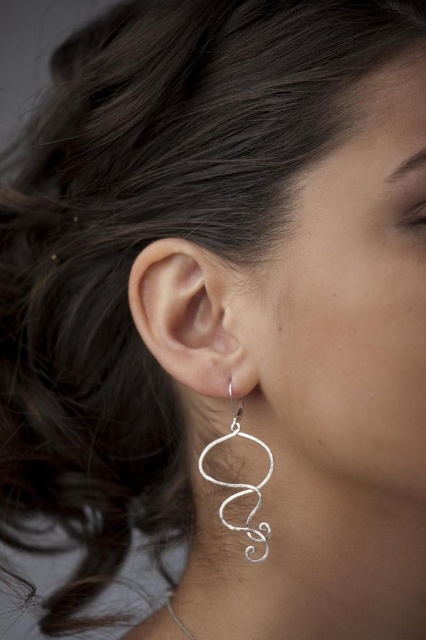
Question: Which of the following is the closest to the observer?

Choices:
 (A) silver wire earring at lower left
 (B) silver wire necklace at lower center
 (C) silver wire earring at center

Answer: (C)

Question: Does silver wire earring at center appear over silver wire earring at lower left?

Choices:
 (A) no
 (B) yes

Answer: (B)

Question: Among these points, which one is nearest to the camera?

Choices:
 (A) (229, 502)
 (B) (172, 609)
 (C) (141, 284)

Answer: (C)

Question: Which of the following is the closest to the observer?

Choices:
 (A) silver wire earring at center
 (B) silver wire necklace at lower center

Answer: (A)

Question: Does silver wire earring at lower left have a greater width compared to silver wire necklace at lower center?

Choices:
 (A) no
 (B) yes

Answer: (B)

Question: Does silver wire earring at lower left have a lesser width compared to silver wire necklace at lower center?

Choices:
 (A) no
 (B) yes

Answer: (A)